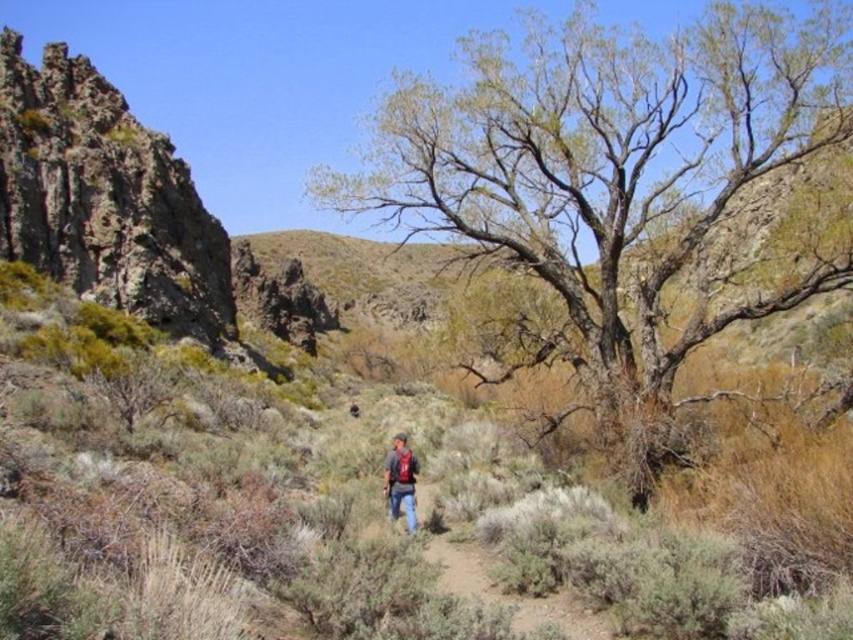
Question: Which of the following is the closest to the observer?

Choices:
 (A) denim jacket at center
 (B) rugged stone cliff at left
 (C) brown dry grass at center
 (D) green rough bark tree at center

Answer: (C)

Question: Which point is farther to the camera?

Choices:
 (A) brown dirt path at center
 (B) brown dry grass at center
 (C) green rough bark tree at center
 (D) rugged stone cliff at left

Answer: (D)

Question: Is brown dry grass at center below brown dirt path at center?

Choices:
 (A) no
 (B) yes

Answer: (A)

Question: Which point is closer to the camera?

Choices:
 (A) rugged stone cliff at left
 (B) brown dirt path at center
 (C) denim jacket at center

Answer: (B)

Question: Is brown dry grass at center in front of denim jacket at center?

Choices:
 (A) yes
 (B) no

Answer: (A)

Question: Does brown dry grass at center appear under rugged stone cliff at left?

Choices:
 (A) no
 (B) yes

Answer: (B)